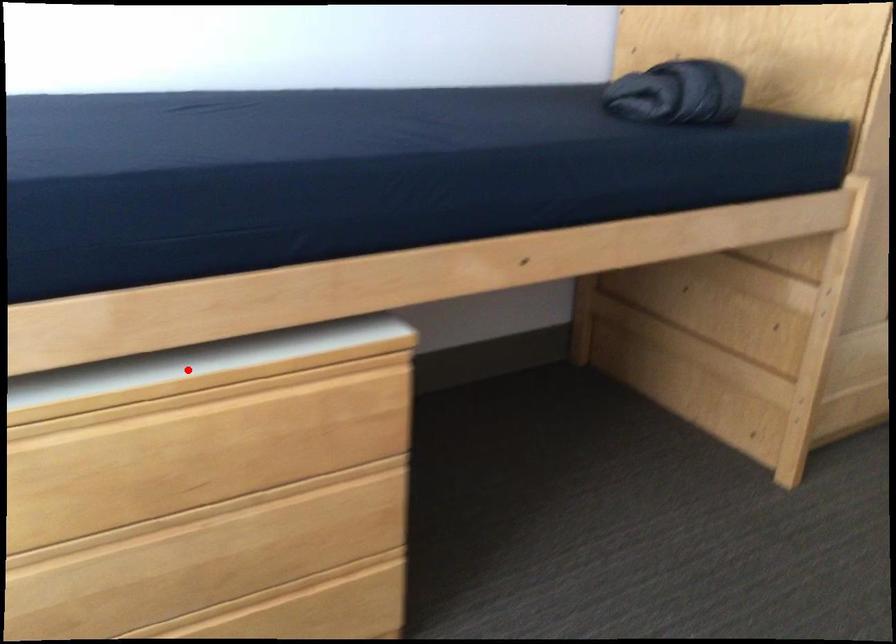
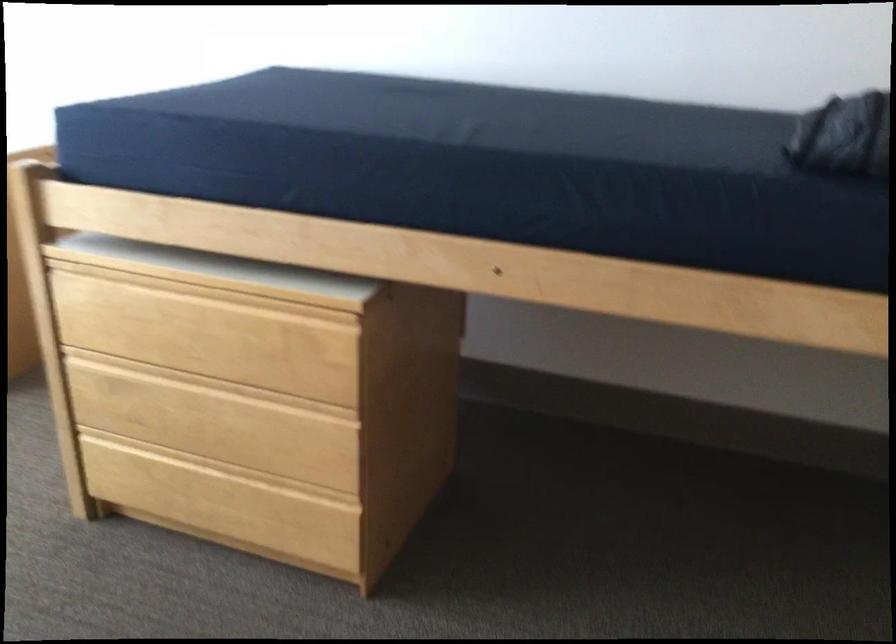
Where in the second image is the point corresponding to the highlighted location from the first image?

(217, 272)